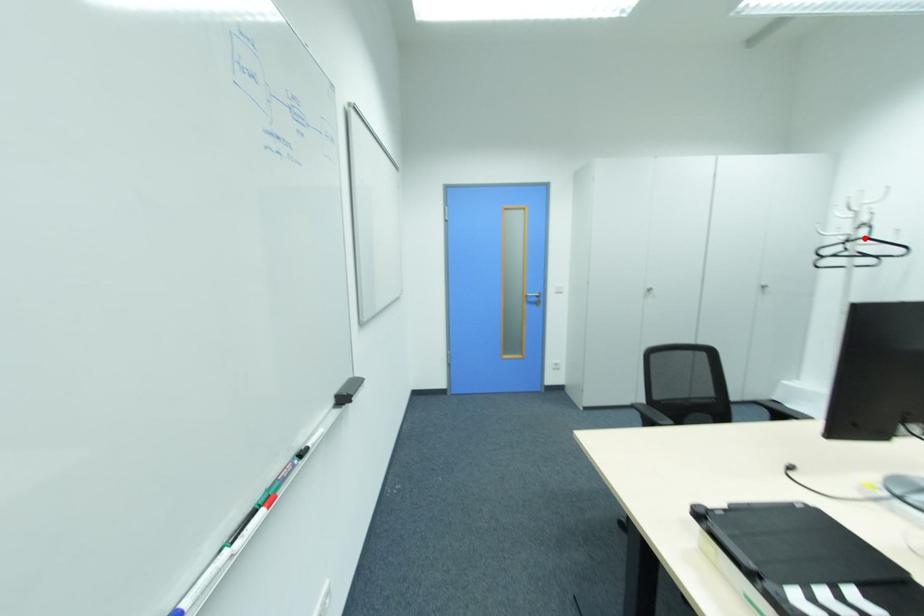
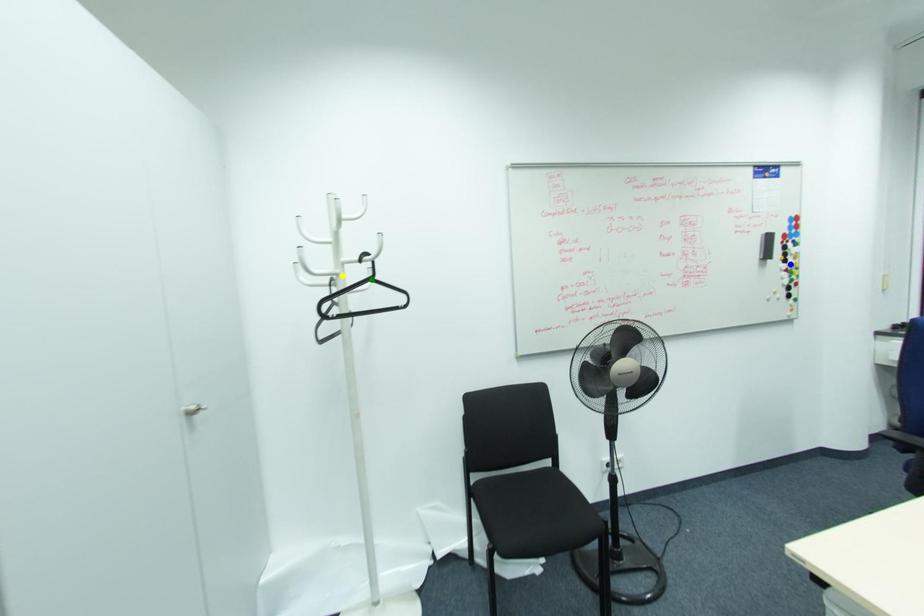
Question: I am providing you with two images of the same scene from different viewpoints. A red point is marked on the first image. You are given multiple points on the second image. In image 2, which mark is for the same physical point as the one in image 1?

Choices:
 (A) blue point
 (B) green point
 (C) yellow point

Answer: (B)